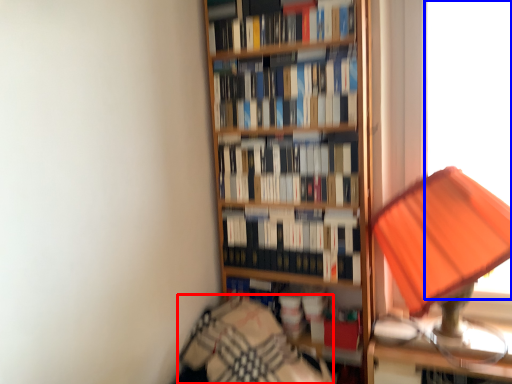
Question: Which object appears closest to the camera in this image, bedding (highlighted by a red box) or window screen (highlighted by a blue box)?

Choices:
 (A) bedding
 (B) window screen

Answer: (A)